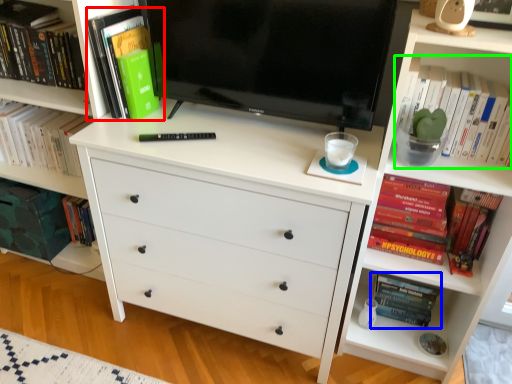
Question: Which is nearer to the book (highlighted by a red box)? book (highlighted by a blue box) or book (highlighted by a green box).

Choices:
 (A) book
 (B) book

Answer: (B)